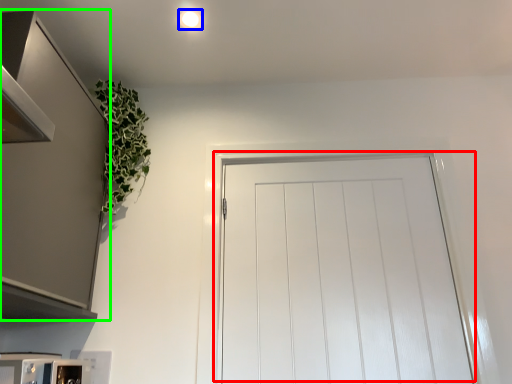
Question: Which object is positioned closest to door (highlighted by a red box)? Select from lighting (highlighted by a blue box) and cabinetry (highlighted by a green box).

Choices:
 (A) lighting
 (B) cabinetry

Answer: (B)